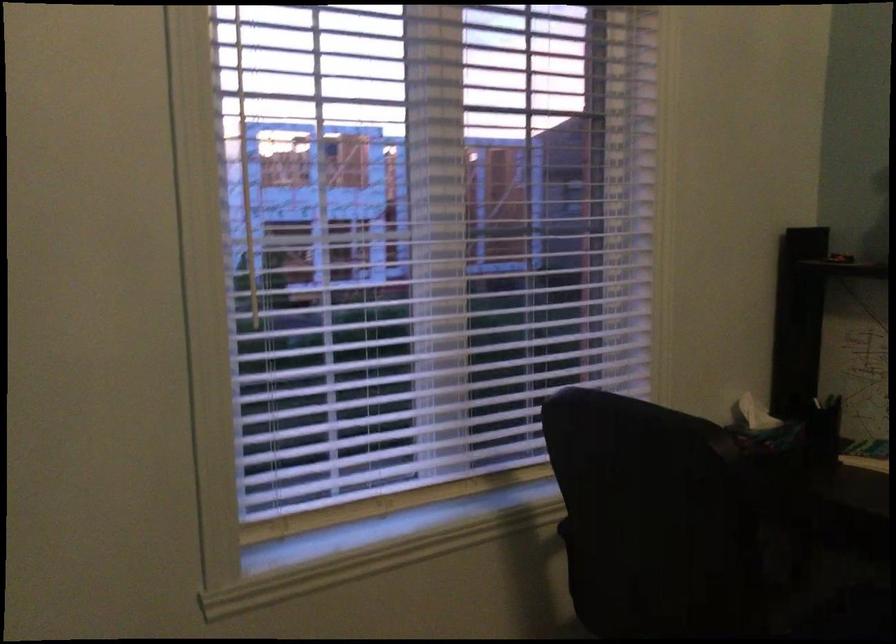
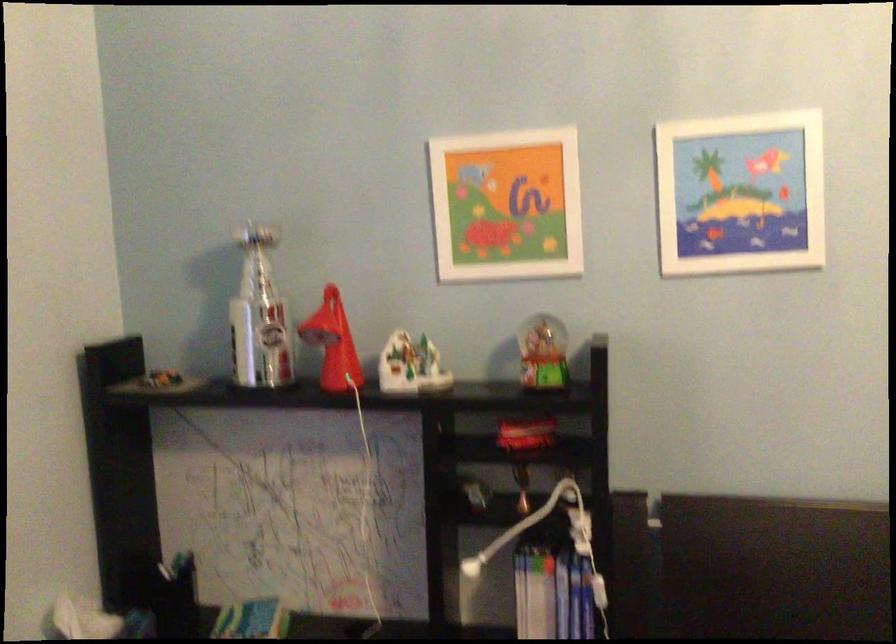
Question: The images are taken continuously from a first-person perspective. In which direction is your viewpoint rotating?

Choices:
 (A) Left
 (B) Right
 (C) Up
 (D) Down

Answer: (B)